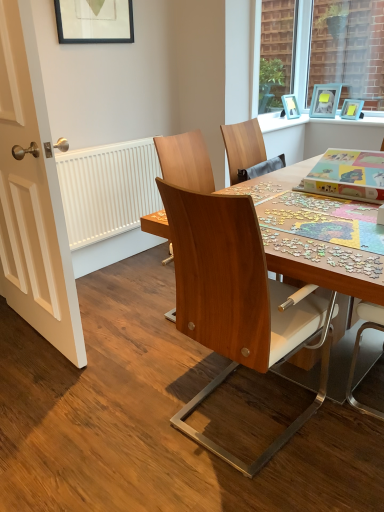
Question: Does matte blue picture frame at upper right, which ranks as the second picture frame in front-to-back order, have a greater width compared to white painted wood door at left?

Choices:
 (A) yes
 (B) no

Answer: (B)

Question: Is matte blue picture frame at upper right, which ranks as the second picture frame in front-to-back order, smaller than white painted wood door at left?

Choices:
 (A) yes
 (B) no

Answer: (A)

Question: Is matte blue picture frame at upper right, which ranks as the second picture frame in front-to-back order, not near white painted wood door at left?

Choices:
 (A) no
 (B) yes

Answer: (B)

Question: Is matte blue picture frame at upper right, the 2th picture frame when ordered from back to front, next to white painted wood door at left and touching it?

Choices:
 (A) no
 (B) yes

Answer: (A)

Question: From a real-world perspective, is matte blue picture frame at upper right, which ranks as the 1th picture frame in right-to-left order, on top of white painted wood door at left?

Choices:
 (A) yes
 (B) no

Answer: (A)

Question: Considering the positions of point (62, 1) and point (180, 249), is point (62, 1) closer or farther from the camera than point (180, 249)?

Choices:
 (A) closer
 (B) farther

Answer: (B)

Question: From the image's perspective, is matte black picture frame at upper left, which is the third picture frame from right to left, located above or below wooden chair at center, which appears as the 1th chair when viewed from the right?

Choices:
 (A) above
 (B) below

Answer: (A)

Question: In terms of size, does matte black picture frame at upper left, which is the first picture frame from front to back, appear bigger or smaller than wooden chair at center, the second chair when ordered from left to right?

Choices:
 (A) small
 (B) big

Answer: (A)

Question: Is matte black picture frame at upper left, which is the 3th picture frame in back-to-front order, in front of or behind wooden chair at center, which appears as the 1th chair when viewed from the right, in the image?

Choices:
 (A) front
 (B) behind

Answer: (B)

Question: Is point (152, 158) closer or farther from the camera than point (173, 309)?

Choices:
 (A) closer
 (B) farther

Answer: (B)

Question: From a real-world perspective, is white matte radiator at left physically located above or below wooden chair at center, which is the first chair in left-to-right order?

Choices:
 (A) above
 (B) below

Answer: (B)

Question: Considering the positions of white matte radiator at left and wooden chair at center, which is the first chair in left-to-right order, in the image, is white matte radiator at left wider or thinner than wooden chair at center, which is the first chair in left-to-right order,?

Choices:
 (A) thin
 (B) wide

Answer: (A)

Question: Considering the positions of white matte radiator at left and wooden chair at center, acting as the 2th chair starting from the right, in the image, is white matte radiator at left taller or shorter than wooden chair at center, acting as the 2th chair starting from the right,?

Choices:
 (A) tall
 (B) short

Answer: (B)

Question: From their relative heights in the image, would you say wooden chair at center, the second chair when ordered from left to right, is taller or shorter than light blue plastic picture frame at upper right, the 1th picture frame viewed from the back?

Choices:
 (A) tall
 (B) short

Answer: (A)

Question: Is wooden chair at center, which appears as the 1th chair when viewed from the right, situated inside light blue plastic picture frame at upper right, marked as the 2th picture frame in a right-to-left arrangement, or outside?

Choices:
 (A) inside
 (B) outside

Answer: (B)